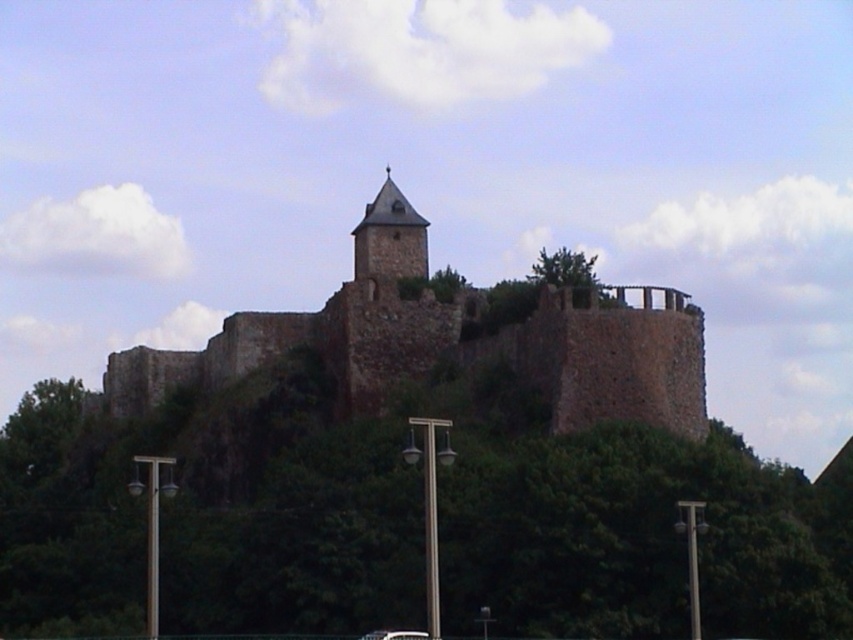
Question: Can you confirm if rustic stone tower at center is positioned above black glossy car at lower center?

Choices:
 (A) yes
 (B) no

Answer: (A)

Question: Which point is closer to the camera taking this photo?

Choices:
 (A) (402, 630)
 (B) (442, 314)
 (C) (358, 259)

Answer: (A)

Question: Among these objects, which one is farthest from the camera?

Choices:
 (A) rustic stone tower at center
 (B) brown stone castle at center

Answer: (A)

Question: In this image, where is brown stone castle at center located relative to rustic stone tower at center?

Choices:
 (A) right
 (B) left

Answer: (B)

Question: Does brown stone castle at center appear on the left side of black glossy car at lower center?

Choices:
 (A) yes
 (B) no

Answer: (A)

Question: Which of the following is the closest to the observer?

Choices:
 (A) (393, 218)
 (B) (404, 202)

Answer: (A)